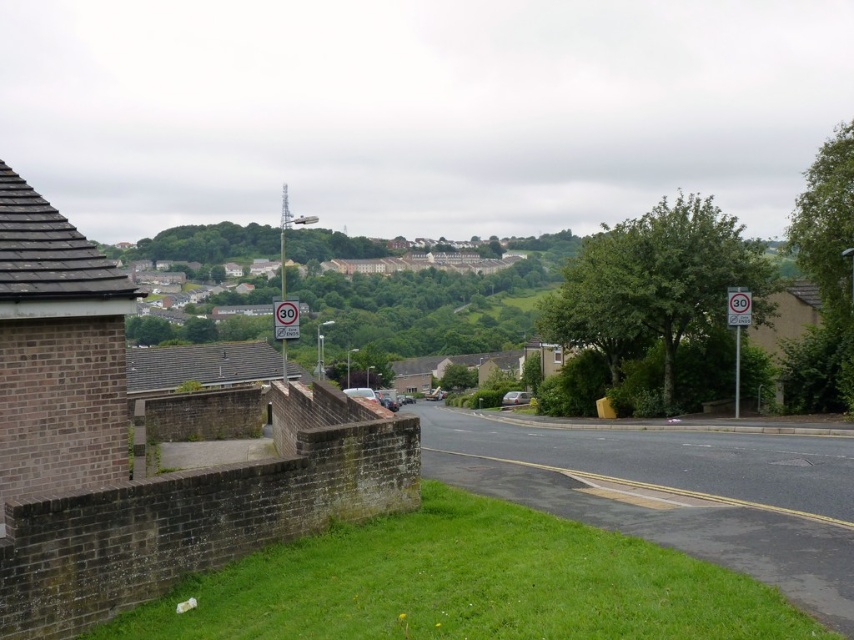
Is white plastic speed limit sign at right in front of metallic silver speed limit sign at center?

No, it is not.

Between point (747, 305) and point (284, 333), which one is positioned behind?

Positioned behind is point (747, 305).

Describe the element at coordinates (736, 330) in the screenshot. The width and height of the screenshot is (854, 640). I see `white plastic speed limit sign at right` at that location.

Where is `white plastic speed limit sign at right`? white plastic speed limit sign at right is located at coordinates (736, 330).